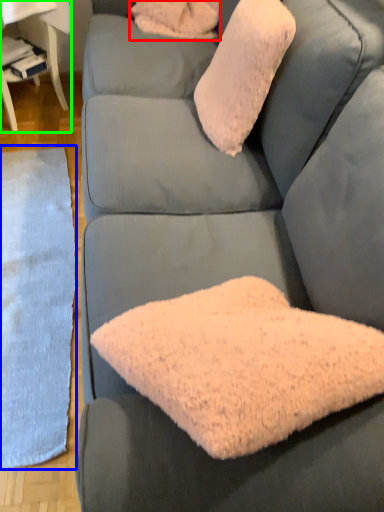
Question: Which object is the farthest from pillow (highlighted by a red box)? Choose among these: mat (highlighted by a blue box) or table (highlighted by a green box).

Choices:
 (A) mat
 (B) table

Answer: (A)